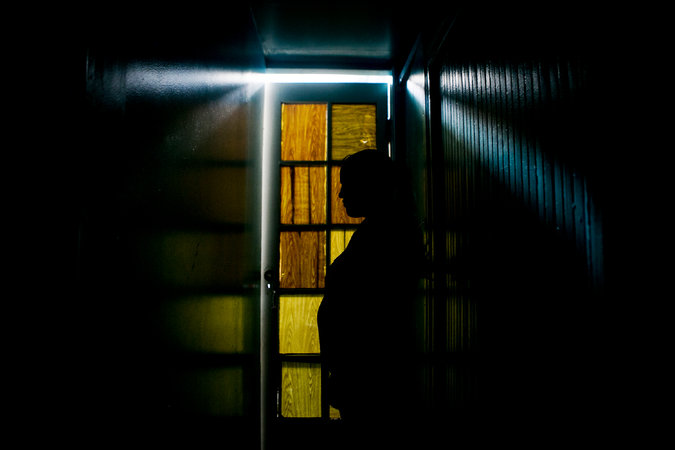
This screenshot has width=675, height=450. In order to click on bright white light bar in this screenshot , I will do `click(292, 81)`, `click(372, 81)`.